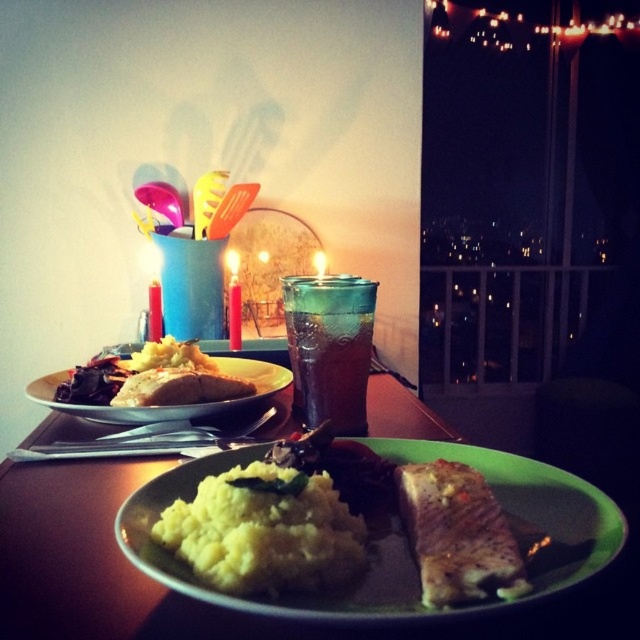
You are a food delivery person who needs to place a hot dish on the table without touching the existing items. The dish is 10 centimeters wide. Can you safely place it between the green plate at center and the yellow mashed potatoes at center?

The green plate at center and yellow mashed potatoes at center are 11.45 centimeters apart from each other. Since the dish is 10 centimeters wide, there is enough space to place it between them without touching either item.

You are a waiter in a restaurant and need to place a new dish exactly where the green plate at center was. According to the coordinates provided, where should you place the new dish?

The new dish should be placed at point (198,602) where the green plate at center was located.

You are a food photographer who needs to capture a closeup shot of the yellow mashed potatoes at center. Your camera is currently positioned 12 inches away from the plate. Do you need to move closer or farther away to get the required distance for the shot?

The yellow mashed potatoes at center and camera are 11.51 inches apart from each other. Since your camera is currently at 12 inches away, you need to move slightly closer to reduce the distance by approximately 0.49 inches to achieve the required positioning.